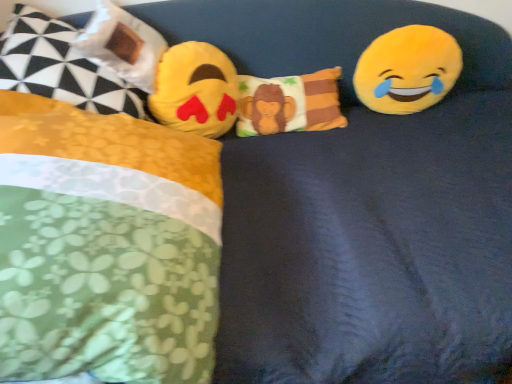
Question: Considering the relative sizes of fluffy yellow pillow at left, acting as the 2th pillow starting from the right, and fluffy cotton monkey pillow at center, which is the first pillow from right to left, in the image provided, is fluffy yellow pillow at left, acting as the 2th pillow starting from the right, thinner than fluffy cotton monkey pillow at center, which is the first pillow from right to left,?

Choices:
 (A) no
 (B) yes

Answer: (A)

Question: Is fluffy yellow pillow at left, arranged as the 3th pillow when viewed from the left, looking in the opposite direction of fluffy cotton monkey pillow at center, the 4th pillow positioned from the left?

Choices:
 (A) no
 (B) yes

Answer: (A)

Question: From the image's perspective, is fluffy yellow pillow at left, arranged as the 3th pillow when viewed from the left, on top of fluffy cotton monkey pillow at center, the 4th pillow positioned from the left?

Choices:
 (A) yes
 (B) no

Answer: (B)

Question: Does fluffy yellow pillow at left, arranged as the 3th pillow when viewed from the left, turn towards fluffy cotton monkey pillow at center, which is the first pillow from right to left?

Choices:
 (A) no
 (B) yes

Answer: (A)

Question: Considering the relative positions of fluffy yellow pillow at left, arranged as the 3th pillow when viewed from the left, and fluffy cotton monkey pillow at center, which is the first pillow from right to left, in the image provided, is fluffy yellow pillow at left, arranged as the 3th pillow when viewed from the left, behind fluffy cotton monkey pillow at center, which is the first pillow from right to left,?

Choices:
 (A) no
 (B) yes

Answer: (A)

Question: In terms of width, does yellow plush emoji at center, the 2th toy in the right-to-left sequence, look wider or thinner when compared to yellow plush emoji at upper right, which is the 2th toy from left to right?

Choices:
 (A) wide
 (B) thin

Answer: (A)

Question: In the image, is yellow plush emoji at center, the 2th toy in the right-to-left sequence, positioned in front of or behind yellow plush emoji at upper right, which is the 2th toy from left to right?

Choices:
 (A) behind
 (B) front

Answer: (B)

Question: Do you think yellow plush emoji at center, positioned as the 1th toy in left-to-right order, is within yellow plush emoji at upper right, which is the first toy from right to left, or outside of it?

Choices:
 (A) outside
 (B) inside

Answer: (A)

Question: From a real-world perspective, is yellow plush emoji at center, positioned as the 1th toy in left-to-right order, physically located above or below yellow plush emoji at upper right, which is the 2th toy from left to right?

Choices:
 (A) below
 (B) above

Answer: (B)

Question: Visually, is floral fabric pillow at left, the 1th pillow in the left-to-right sequence, positioned to the left or to the right of fluffy cotton monkey pillow at center, which is the first pillow from right to left?

Choices:
 (A) left
 (B) right

Answer: (A)

Question: Is floral fabric pillow at left, which ranks as the fourth pillow in right-to-left order, bigger or smaller than fluffy cotton monkey pillow at center, the 4th pillow positioned from the left?

Choices:
 (A) small
 (B) big

Answer: (B)

Question: In terms of width, does floral fabric pillow at left, the 1th pillow in the left-to-right sequence, look wider or thinner when compared to fluffy cotton monkey pillow at center, which is the first pillow from right to left?

Choices:
 (A) wide
 (B) thin

Answer: (A)

Question: In terms of height, does floral fabric pillow at left, the 1th pillow in the left-to-right sequence, look taller or shorter compared to fluffy cotton monkey pillow at center, the 4th pillow positioned from the left?

Choices:
 (A) tall
 (B) short

Answer: (A)

Question: Is matte plastic bag at upper left, the 2th pillow from the left, bigger or smaller than fluffy cotton monkey pillow at center, which is the first pillow from right to left?

Choices:
 (A) big
 (B) small

Answer: (A)

Question: From the image's perspective, is matte plastic bag at upper left, the third pillow when ordered from right to left, above or below fluffy cotton monkey pillow at center, the 4th pillow positioned from the left?

Choices:
 (A) below
 (B) above

Answer: (B)